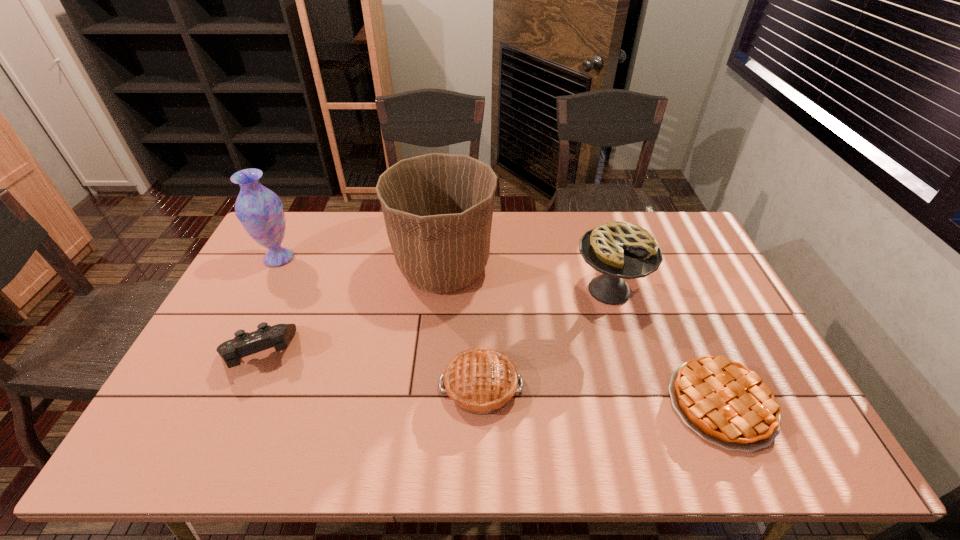
Where is `free space that is in between the leftmost pie and the flowerpot`? This screenshot has height=540, width=960. free space that is in between the leftmost pie and the flowerpot is located at coordinates (462, 327).

At what (x,y) coordinates should I click in order to perform the action: click on vacant point located between the flowerpot and the vase. Please return your answer as a coordinate pair (x, y). Looking at the image, I should click on (361, 263).

Where is `free space between the farthest pie and the fifth tallest object`? This screenshot has width=960, height=540. free space between the farthest pie and the fifth tallest object is located at coordinates (545, 338).

At what (x,y) coordinates should I click in order to perform the action: click on vacant space that is in between the control and the vase. Please return your answer as a coordinate pair (x, y). This screenshot has height=540, width=960. Looking at the image, I should click on (269, 306).

Find the location of a particular element. Image resolution: width=960 pixels, height=540 pixels. vacant space that is in between the shortest object and the third tallest object is located at coordinates (665, 347).

The width and height of the screenshot is (960, 540). What are the coordinates of `blank region between the shortest object and the flowerpot` in the screenshot? It's located at (582, 336).

The image size is (960, 540). Identify the location of vacant area that lies between the shortest pie and the fourth shortest object. (665, 347).

Find the location of a particular element. free space between the third tallest object and the control is located at coordinates (434, 322).

What are the coordinates of `object that is the fourth closest to the tallest pie` in the screenshot? It's located at (244, 344).

Identify which object is the third nearest to the control. Please provide its 2D coordinates. Your answer should be formatted as a tuple, i.e. [(x, y)], where the tuple contains the x and y coordinates of a point satisfying the conditions above.

[(481, 381)]